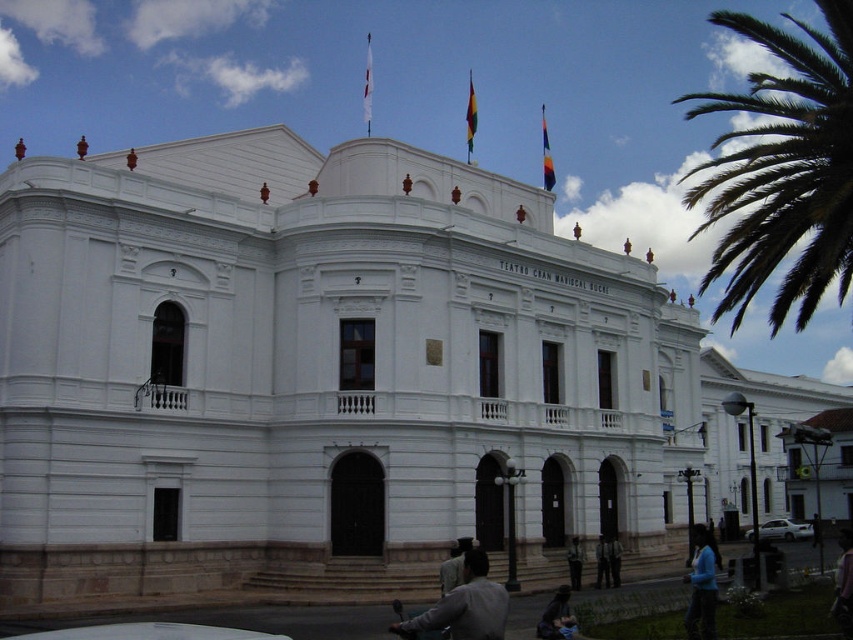
Looking at this image, which is more to the left, dark blue jeans at lower center or dark blue uniform at center?

From the viewer's perspective, dark blue jeans at lower center appears more on the left side.

Is dark blue jeans at lower center thinner than dark blue uniform at center?

Correct, dark blue jeans at lower center's width is less than dark blue uniform at center's.

Find the location of a particular element. dark blue jeans at lower center is located at coordinates (602, 563).

Does point (554, 173) come farther from viewer compared to point (569, 545)?

Yes, it is.

Is multicolored fabric flag at upper right wider than dark blue suit at center?

Correct, the width of multicolored fabric flag at upper right exceeds that of dark blue suit at center.

Where is `multicolored fabric flag at upper right`? multicolored fabric flag at upper right is located at coordinates (546, 154).

Can you confirm if green leafy palm at upper right is wider than blue fabric jacket at lower center?

Indeed, green leafy palm at upper right has a greater width compared to blue fabric jacket at lower center.

In the scene shown: Is green leafy palm at upper right closer to camera compared to blue fabric jacket at lower center?

No.

Does point (775, 40) come closer to viewer compared to point (708, 614)?

No, (775, 40) is further to viewer.

Where is `green leafy palm at upper right`? green leafy palm at upper right is located at coordinates (782, 170).